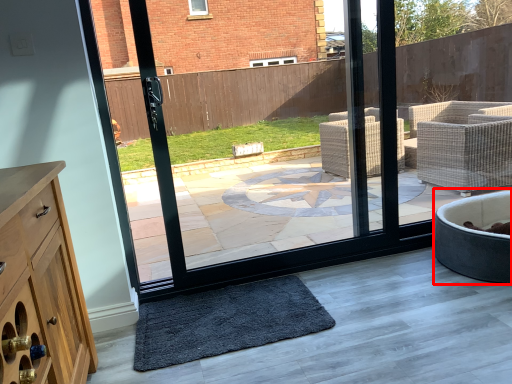
Question: From the image, what is the correct spatial relationship of bath (annotated by the red box) in relation to mat?

Choices:
 (A) right
 (B) left

Answer: (A)